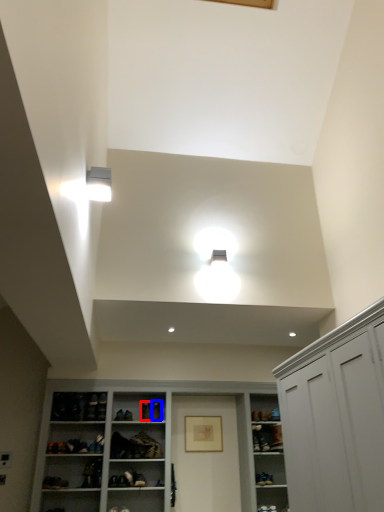
Question: Which object is closer to the camera taking this photo, shoe (highlighted by a red box) or shoe (highlighted by a blue box)?

Choices:
 (A) shoe
 (B) shoe

Answer: (A)